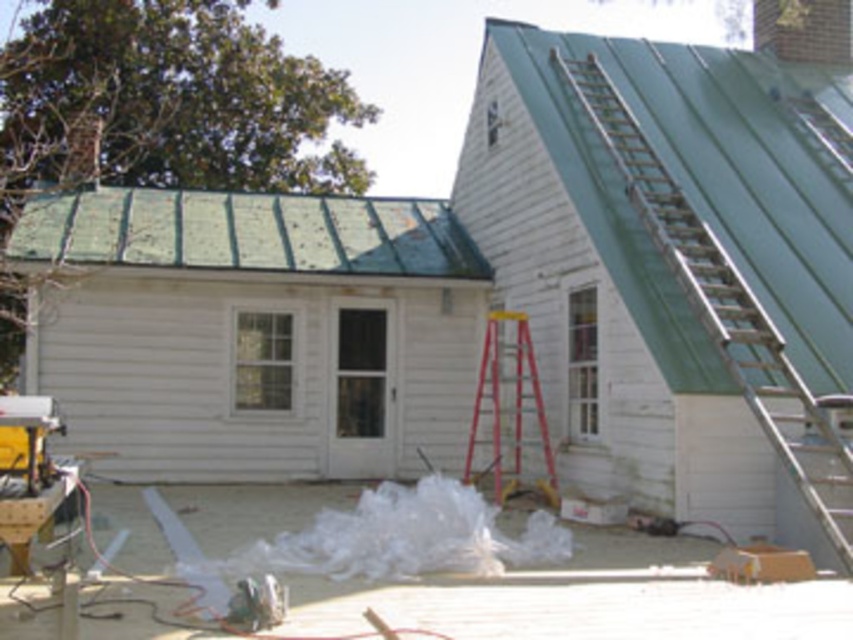
Does point (151, 221) come behind point (798, 20)?

No, (151, 221) is in front of (798, 20).

Does green metal roof at upper left have a smaller size compared to brick chimney at upper right?

Incorrect, green metal roof at upper left is not smaller in size than brick chimney at upper right.

Where is `green metal roof at upper left`? This screenshot has height=640, width=853. green metal roof at upper left is located at coordinates (247, 232).

Which of these two, green metal roof at upper left or metallic silver ladder at upper right, stands taller?

green metal roof at upper left

Does green metal roof at upper left have a greater width compared to metallic silver ladder at upper right?

Indeed, green metal roof at upper left has a greater width compared to metallic silver ladder at upper right.

Between point (428, 260) and point (849, 516), which one is positioned behind?

Positioned behind is point (428, 260).

This screenshot has width=853, height=640. I want to click on green metal roof at upper left, so click(x=247, y=232).

Who is positioned more to the left, red plastic ladder at center or brick chimney at upper right?

From the viewer's perspective, red plastic ladder at center appears more on the left side.

Does point (521, 432) come closer to viewer compared to point (790, 8)?

Yes.

Find the location of a particular element. The height and width of the screenshot is (640, 853). red plastic ladder at center is located at coordinates (508, 406).